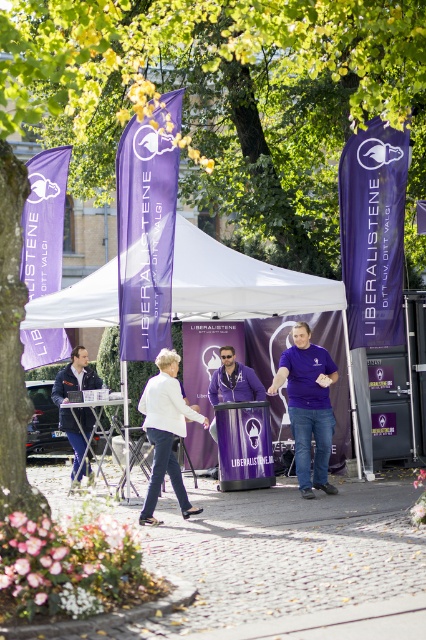
You are a photographer standing at the event location and want to take a photo of the white fabric tent at center. If your camera has a maximum focus range of 12 meters, will you be able to capture the tent clearly?

The white fabric tent at center is 12.96 meters away from the viewer, which exceeds the camera maximum focus range of 12 meters. Therefore, the camera cannot focus on the tent clearly.

From the picture: Where is the white fabric tent at center located in the image?

The white fabric tent at center is located at point (247, 291).